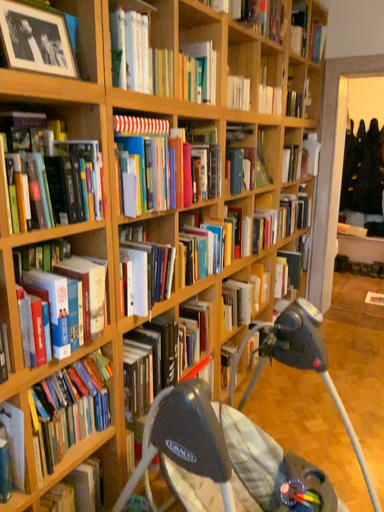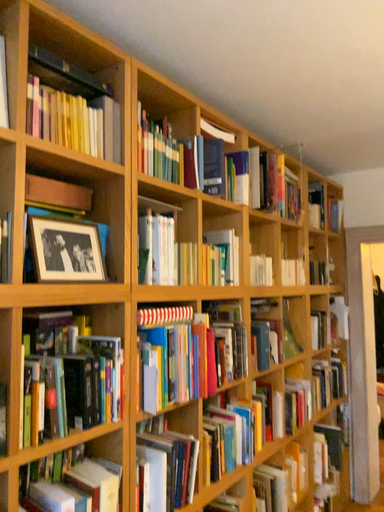
Question: Which way did the camera rotate in the video?

Choices:
 (A) rotated upward
 (B) rotated downward

Answer: (A)